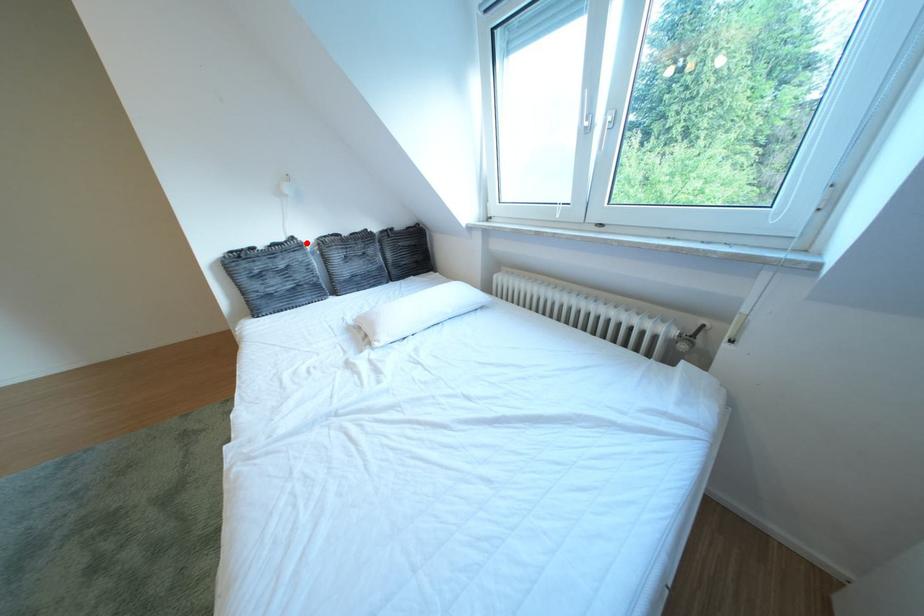
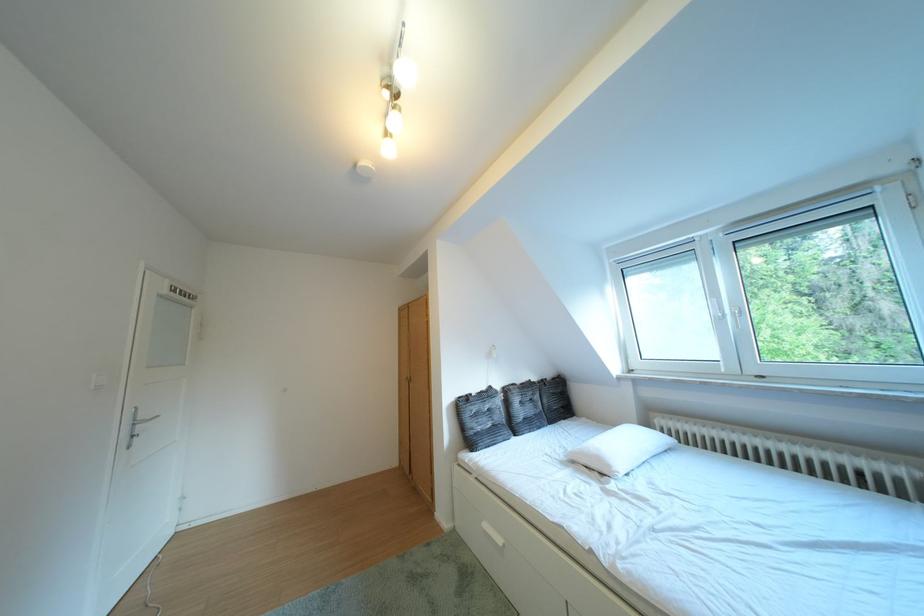
Question: I am providing you with two images of the same scene from different viewpoints. A red point is shown in image1. For the corresponding object point in image2, is it positioned nearer or farther from the camera?

Choices:
 (A) Nearer
 (B) Farther

Answer: (B)